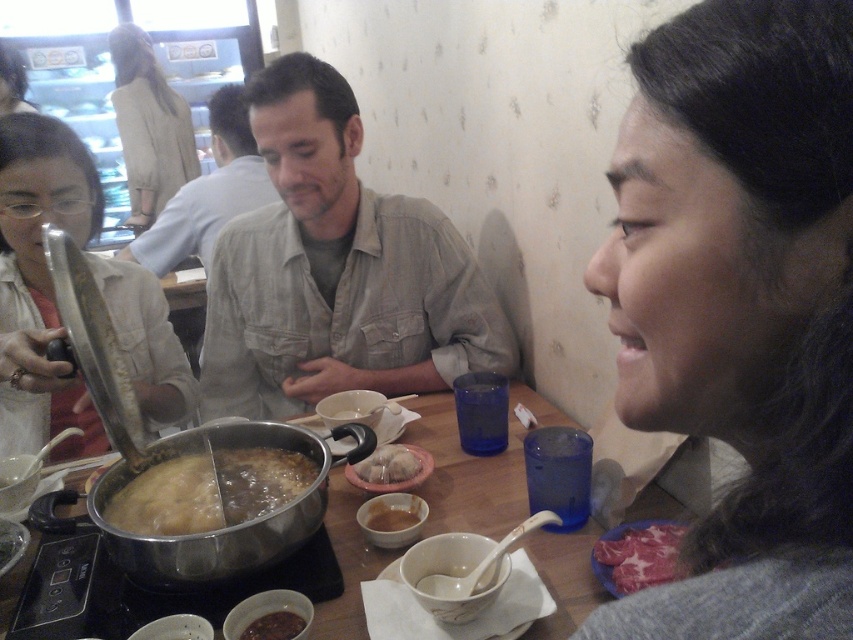
Question: Is light brown shirt at center smaller than brown glossy sauce at center?

Choices:
 (A) yes
 (B) no

Answer: (B)

Question: Which object appears farthest from the camera in this image?

Choices:
 (A) light brown shirt at center
 (B) matte white shirt at center
 (C) raw pink meat at lower right
 (D) khaki cotton shirt at center

Answer: (A)

Question: Which of these objects is positioned closest to the khaki cotton shirt at center?

Choices:
 (A) matte white shirt at center
 (B) smooth gray hair at right

Answer: (A)

Question: Which point is closer to the camera taking this photo?

Choices:
 (A) (798, 232)
 (B) (312, 237)

Answer: (A)

Question: From the image, what is the correct spatial relationship of translucent glass soup at center in relation to brown glossy sauce at center?

Choices:
 (A) below
 (B) above

Answer: (B)

Question: Is matte white shirt at center thinner than brown glossy sauce at center?

Choices:
 (A) no
 (B) yes

Answer: (A)